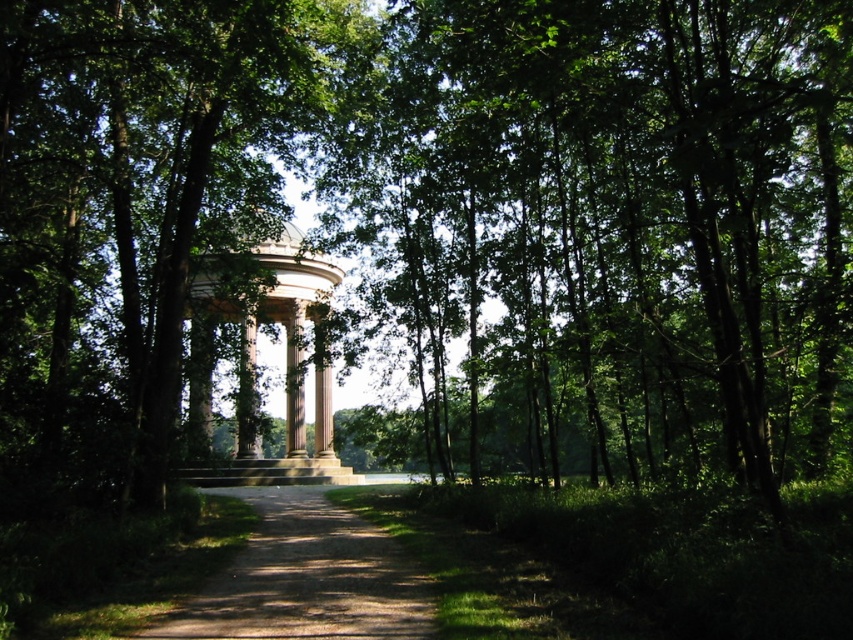
At what (x,y) coordinates should I click in order to perform the action: click on dirt/gravel path at center. Please return your answer as a coordinate pair (x, y). Looking at the image, I should click on (306, 579).